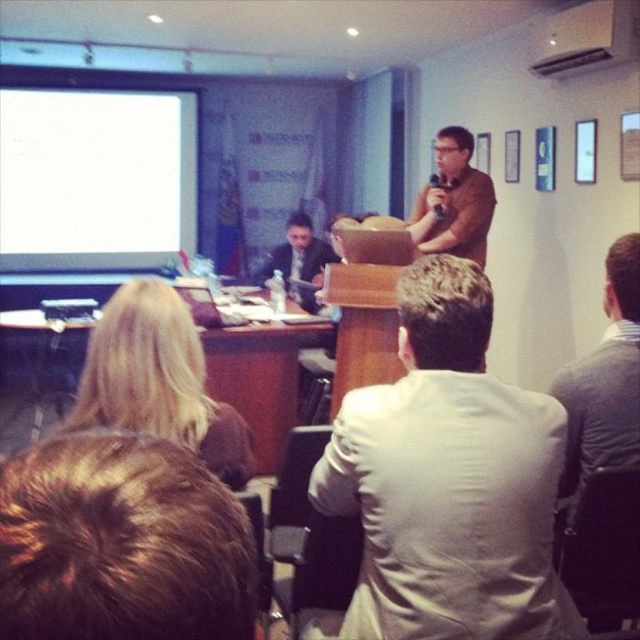
You are an attendee in the conference room. You notice a point marked at coordinates (122, 544). Based on the scene description, can you identify what object or feature this point corresponds to?

The point at coordinates (122, 544) corresponds to the brown hair at lower left.

You are an attendee at this meeting. You need to locate both the white fabric suit at center and the black plastic projector at lower left. Which one is positioned higher in the image?

The black plastic projector at lower left is higher than the white fabric suit at center because the white fabric suit at center is located below it.